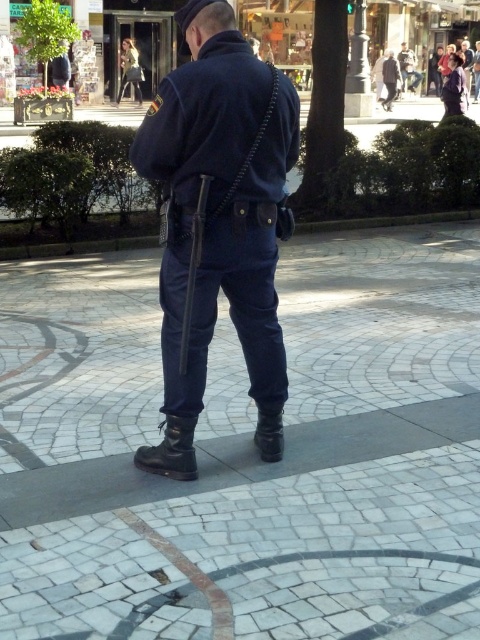
You are a pedestrian standing in the plaza and see the polished metal pole at upper center and the light brown leather jacket at upper center. Which object is closer to the ground?

The polished metal pole at upper center is positioned under the light brown leather jacket at upper center, so it is closer to the ground.

You are standing at the point marked as point (389, 80) in the image. Looking around, you see the police officer in dark blue fabric uniform at center. What is directly under your feet?

The point (389, 80) is on dark blue fabric uniform at center, so the dark blue fabric uniform at center is directly under your feet.